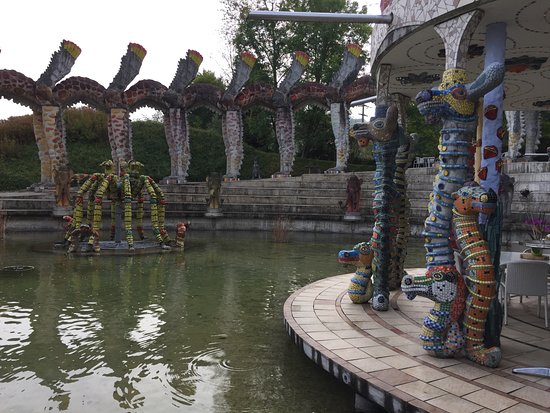
Where is `darker colored tile`? The height and width of the screenshot is (413, 550). darker colored tile is located at coordinates (393, 375).